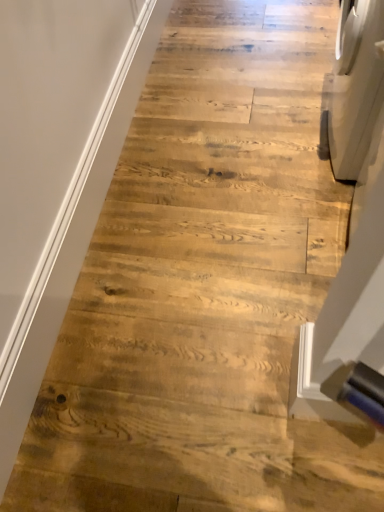
What is the approximate width of white matte door at left?

It is 3.93 centimeters.

The height and width of the screenshot is (512, 384). What do you see at coordinates (57, 168) in the screenshot?
I see `white matte door at left` at bounding box center [57, 168].

Where is `white matte door at left`? The width and height of the screenshot is (384, 512). white matte door at left is located at coordinates (57, 168).

Find the location of a particular element. The height and width of the screenshot is (512, 384). white matte door at left is located at coordinates (57, 168).